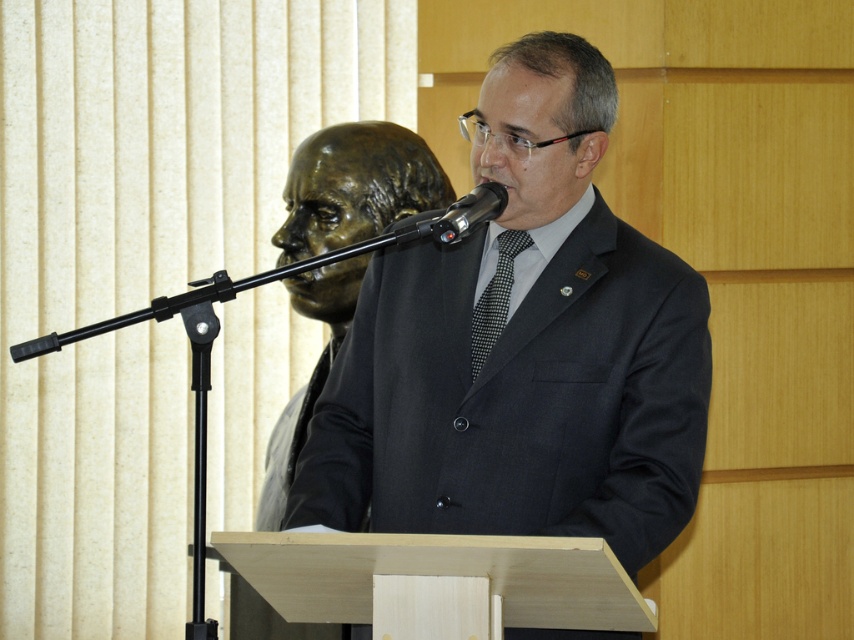
Can you confirm if matte black suit at center is shorter than black dotted fabric tie at center?

Incorrect, matte black suit at center's height does not fall short of black dotted fabric tie at center's.

Does point (395, 480) lie behind point (509, 268)?

No.

Locate an element on the screen. matte black suit at center is located at coordinates (522, 349).

Does matte black suit at center have a smaller size compared to black metallic microphone at center?

Actually, matte black suit at center might be larger than black metallic microphone at center.

What are the coordinates of `matte black suit at center` in the screenshot? It's located at (522, 349).

At what (x,y) coordinates should I click in order to perform the action: click on matte black suit at center. Please return your answer as a coordinate pair (x, y). Looking at the image, I should click on coord(522,349).

Describe the element at coordinates (495, 298) in the screenshot. I see `black dotted fabric tie at center` at that location.

Is black dotted fabric tie at center closer to the viewer compared to black metallic microphone at center?

No, black dotted fabric tie at center is further to the viewer.

The image size is (854, 640). What are the coordinates of `black dotted fabric tie at center` in the screenshot? It's located at (495, 298).

Where is `black dotted fabric tie at center`? Image resolution: width=854 pixels, height=640 pixels. black dotted fabric tie at center is located at coordinates pyautogui.click(x=495, y=298).